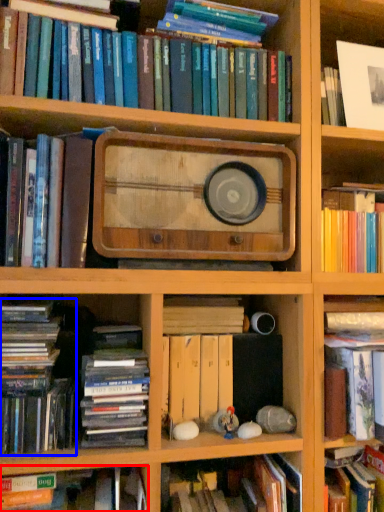
Question: Which object is closer to the camera taking this photo, book (highlighted by a red box) or book (highlighted by a blue box)?

Choices:
 (A) book
 (B) book

Answer: (A)